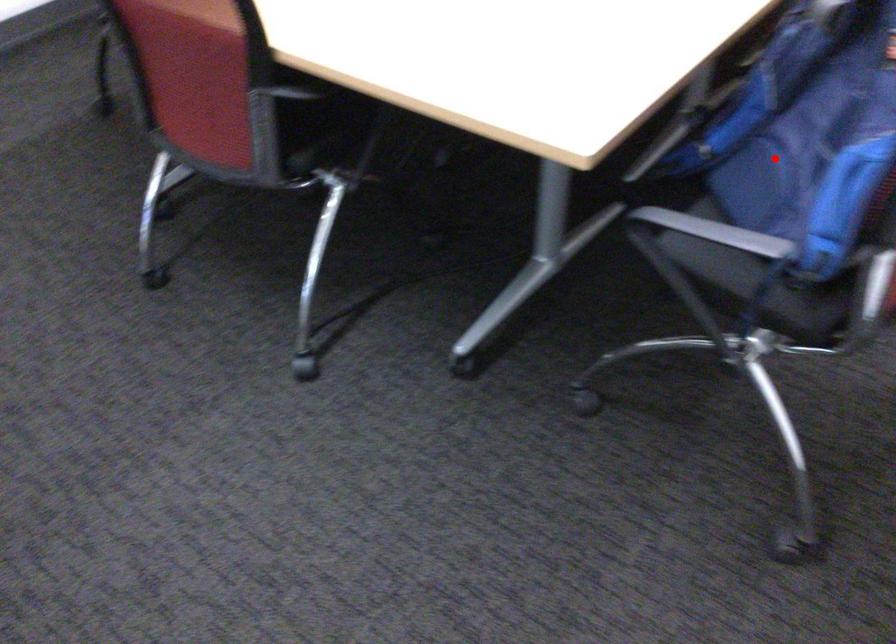
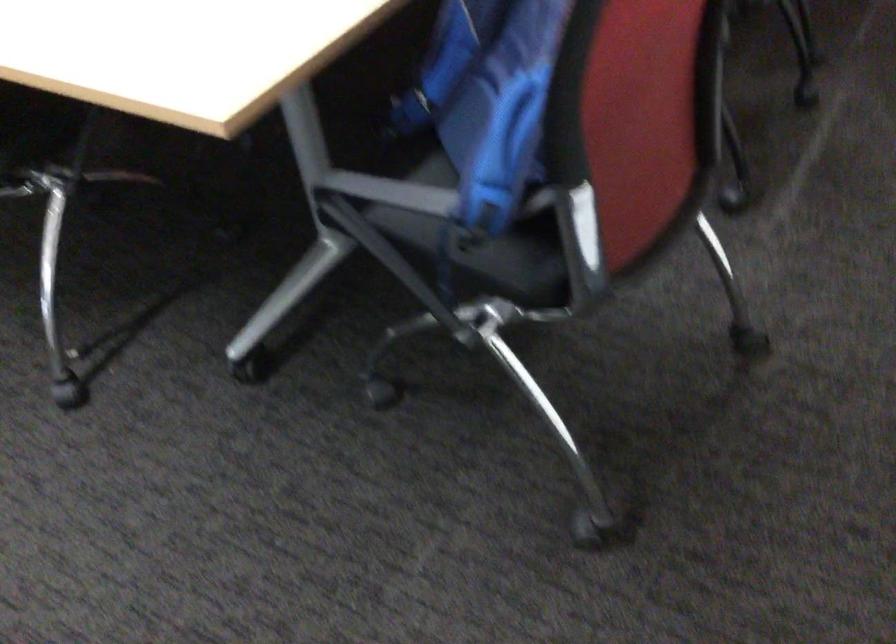
Question: I am providing you with two images of the same scene from different viewpoints. A red point is shown in image1. For the corresponding object point in image2, is it positioned nearer or farther from the camera?

Choices:
 (A) Nearer
 (B) Farther

Answer: (A)